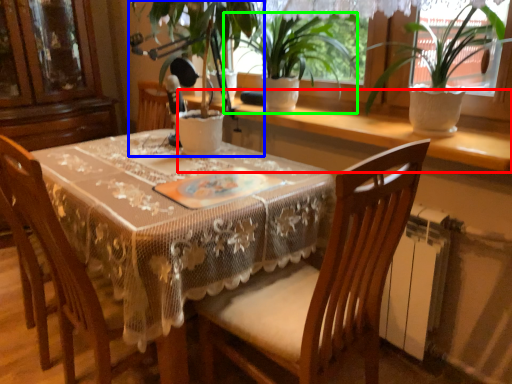
Question: Which object is positioned closest to window sill (highlighted by a red box)? Select from houseplant (highlighted by a blue box) and houseplant (highlighted by a green box).

Choices:
 (A) houseplant
 (B) houseplant

Answer: (B)